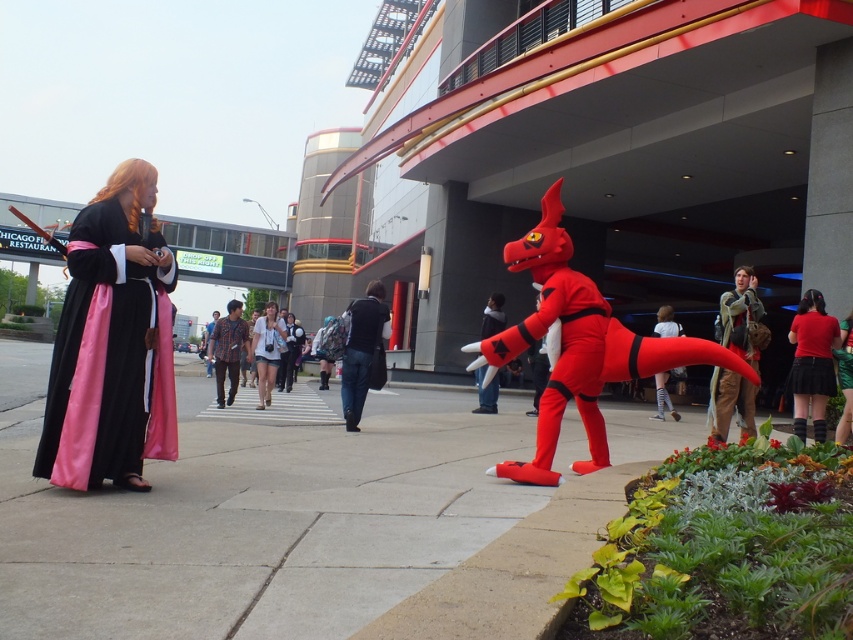
You are a photographer at the event and want to capture both the rubberized red dinosaur at center and the velvet black backpack at center in a single frame. Which object should you position closer to the left side of your camera viewfinder to include both?

To include both the rubberized red dinosaur at center and the velvet black backpack at center in the frame, position the velvet black backpack at center closer to the left side of the camera viewfinder since the rubberized red dinosaur at center is already to the right of it.